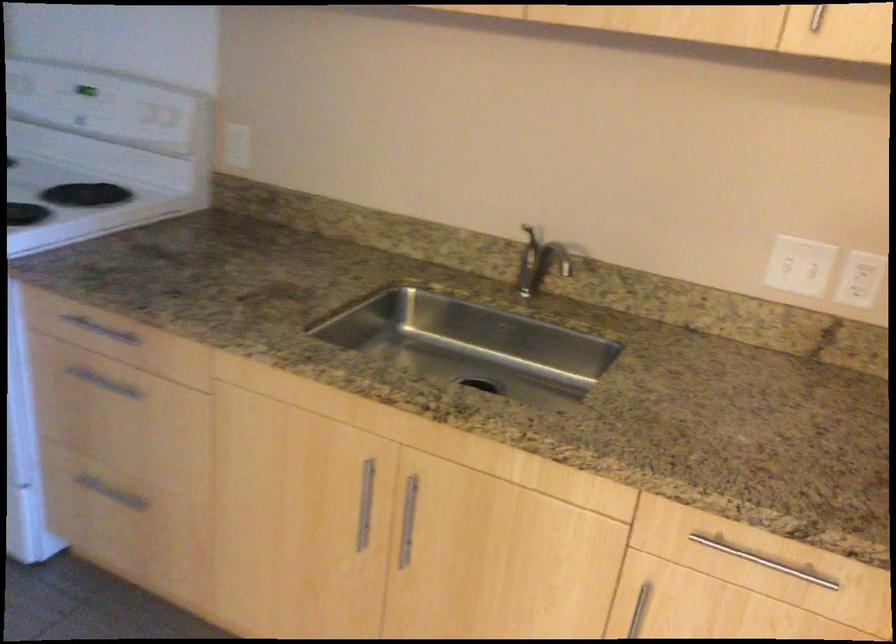
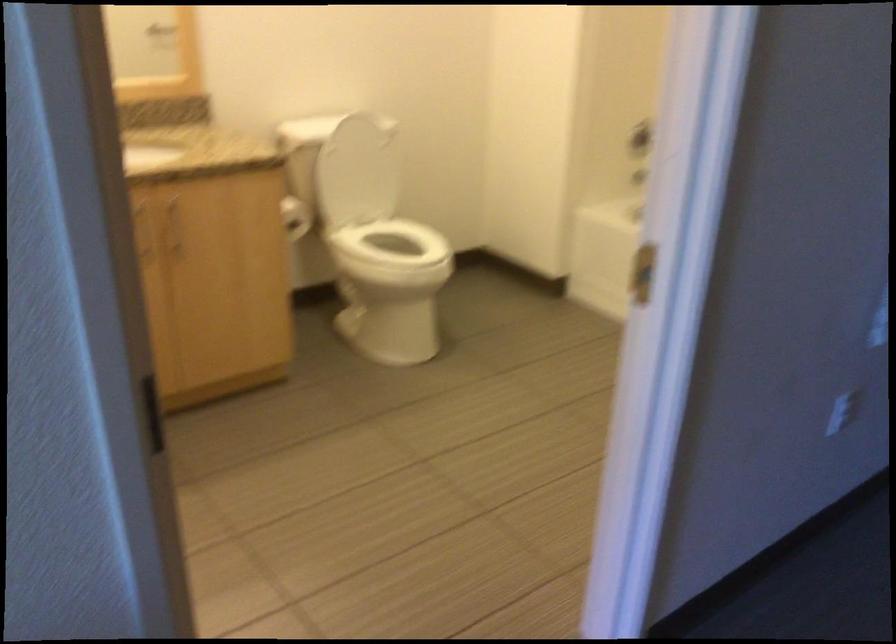
The images are taken continuously from a first-person perspective. In which direction is your viewpoint rotating?

The rotation direction of the camera is left-down.